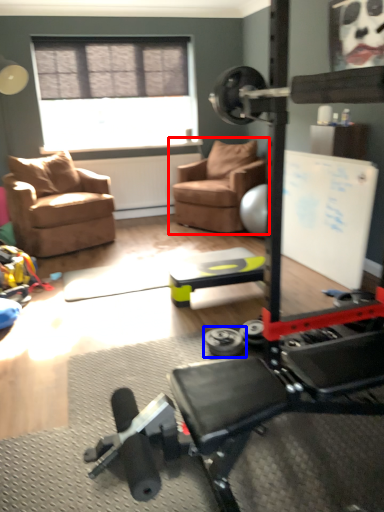
Question: Which object appears farthest to the camera in this image, chair (highlighted by a red box) or dumbbell (highlighted by a blue box)?

Choices:
 (A) chair
 (B) dumbbell

Answer: (A)